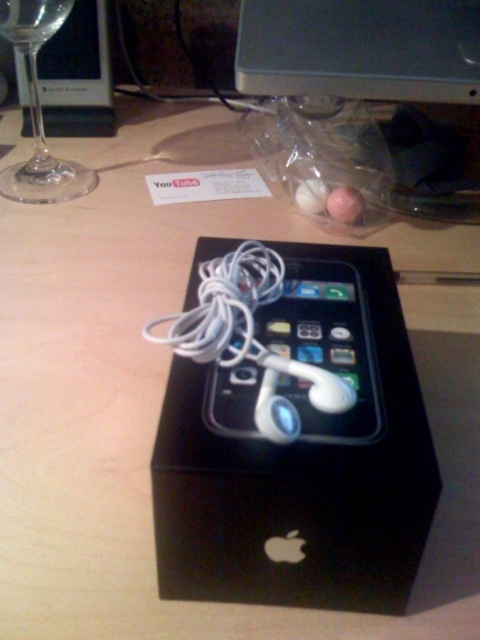
Which is more to the right, metallic silver computer at upper center or white glossy earphones at center?

Positioned to the right is metallic silver computer at upper center.

Describe the element at coordinates (360, 49) in the screenshot. I see `metallic silver computer at upper center` at that location.

The image size is (480, 640). I want to click on metallic silver computer at upper center, so click(x=360, y=49).

Is white glossy earphones at center positioned behind transparent glass at left?

No, white glossy earphones at center is in front of transparent glass at left.

Is point (358, 316) farther from camera compared to point (44, 132)?

That is False.

Does point (339, 321) come farther from viewer compared to point (6, 3)?

No, (339, 321) is closer to viewer.

This screenshot has width=480, height=640. In order to click on white glossy earphones at center in this screenshot , I will do `click(324, 346)`.

Which is above, black matte box at center or white glossy earphones at center?

Positioned higher is white glossy earphones at center.

Between point (208, 371) and point (323, 352), which one is positioned behind?

Positioned behind is point (323, 352).

This screenshot has height=640, width=480. I want to click on black matte box at center, so click(x=300, y=454).